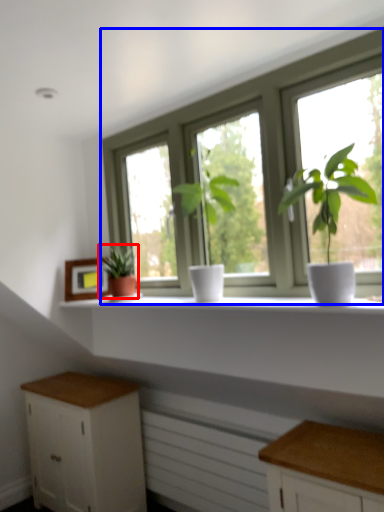
Question: Which object is further to the camera taking this photo, houseplant (highlighted by a red box) or window (highlighted by a blue box)?

Choices:
 (A) houseplant
 (B) window

Answer: (A)